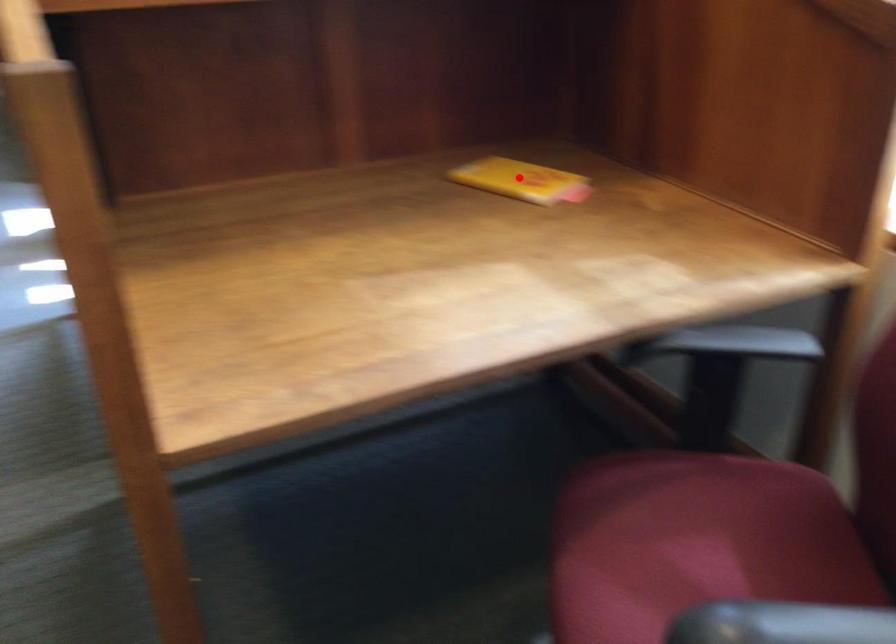
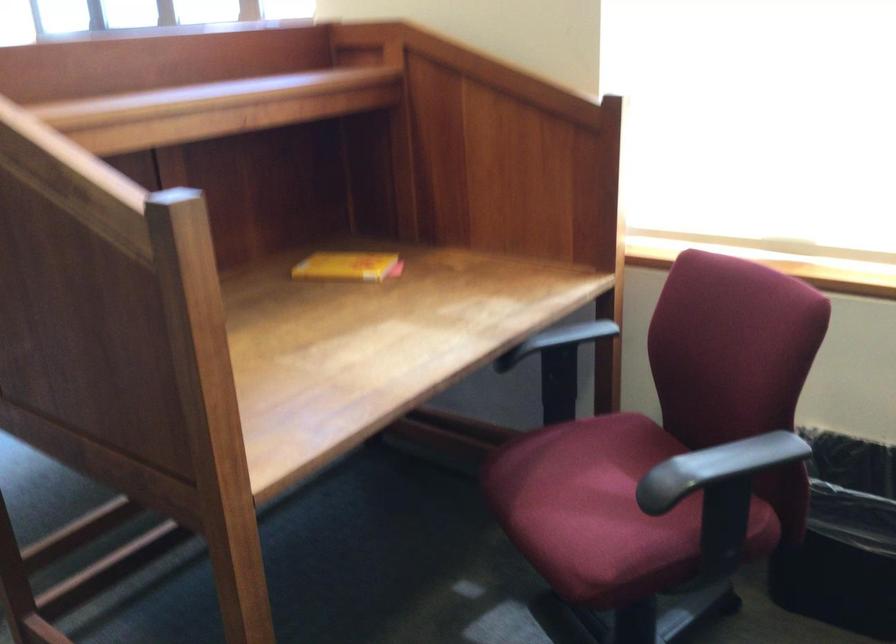
Question: I am providing you with two images of the same scene from different viewpoints. In image1, a red point is highlighted. Considering the same 3D point in image2, which of the following is correct?

Choices:
 (A) It is closer
 (B) It is farther

Answer: (B)